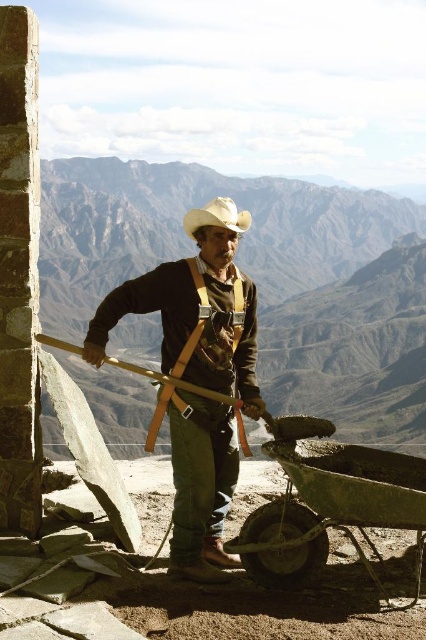
Question: Is brown leather harness at center behind green concrete at lower center?

Choices:
 (A) yes
 (B) no

Answer: (A)

Question: Which of the following is the farthest from the observer?

Choices:
 (A) brown leather harness at center
 (B) green concrete at lower center
 (C) wooden at left

Answer: (C)

Question: Is brown leather harness at center closer to camera compared to white matte cowboy hat at center?

Choices:
 (A) yes
 (B) no

Answer: (A)

Question: Does green concrete at lower center have a lesser width compared to wooden at left?

Choices:
 (A) yes
 (B) no

Answer: (A)

Question: Among these points, which one is farthest from the camera?

Choices:
 (A) (235, 397)
 (B) (193, 221)
 (C) (250, 529)

Answer: (A)

Question: Which point is closer to the camera?

Choices:
 (A) (304, 522)
 (B) (218, 326)

Answer: (A)